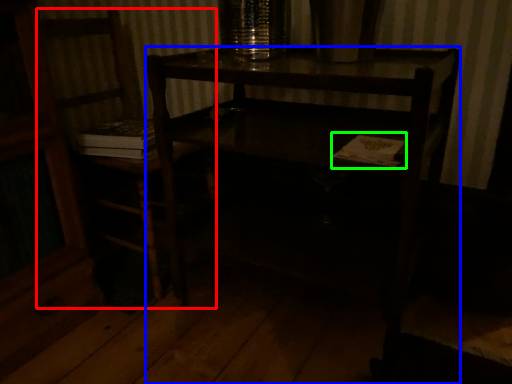
Question: Considering the real-world distances, which object is farthest from chair (highlighted by a red box)? desk (highlighted by a blue box) or book (highlighted by a green box)?

Choices:
 (A) desk
 (B) book

Answer: (B)